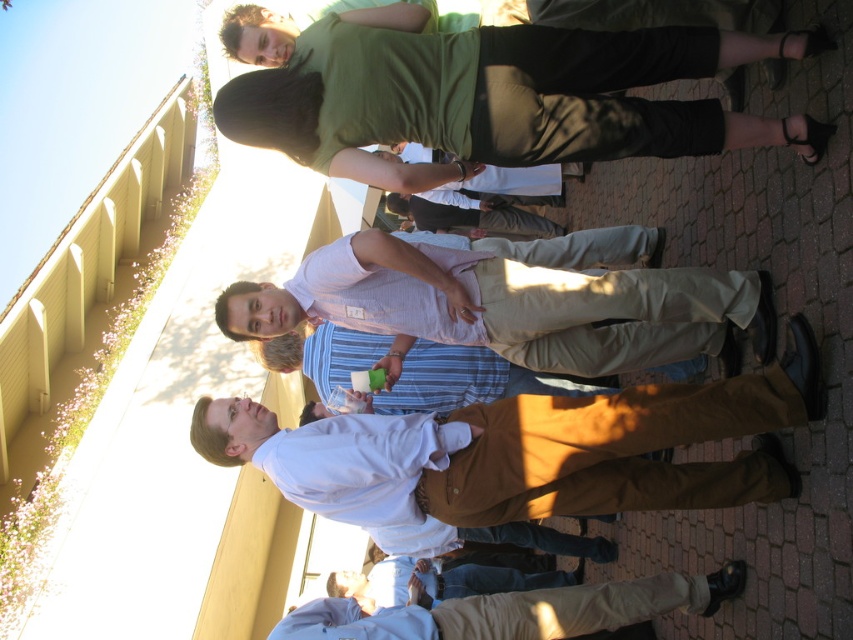
Does green cotton shirt at upper center have a smaller size compared to light brown cotton pants at center?

Indeed, green cotton shirt at upper center has a smaller size compared to light brown cotton pants at center.

Does green cotton shirt at upper center have a greater width compared to light brown cotton pants at center?

Incorrect, green cotton shirt at upper center's width does not surpass light brown cotton pants at center's.

Identify the location of green cotton shirt at upper center. The image size is (853, 640). (498, 96).

The image size is (853, 640). I want to click on green cotton shirt at upper center, so click(x=498, y=96).

Does light brown cotton pants at center appear on the right side of light brown leather pants at lower center?

Yes, light brown cotton pants at center is to the right of light brown leather pants at lower center.

Is light brown cotton pants at center to the left of light brown leather pants at lower center from the viewer's perspective?

Incorrect, light brown cotton pants at center is not on the left side of light brown leather pants at lower center.

What do you see at coordinates (503, 305) in the screenshot? I see `light brown cotton pants at center` at bounding box center [503, 305].

Where is `light brown cotton pants at center`? Image resolution: width=853 pixels, height=640 pixels. light brown cotton pants at center is located at coordinates (503, 305).

Between light brown leather pants at lower center and khaki cotton pants at center, which one appears on the left side from the viewer's perspective?

khaki cotton pants at center is more to the left.

Does light brown leather pants at lower center appear under khaki cotton pants at center?

Yes, light brown leather pants at lower center is below khaki cotton pants at center.

Who is more distant from viewer, (567,632) or (416,208)?

The point (416,208) is behind.

Where is `light brown leather pants at lower center`? This screenshot has width=853, height=640. light brown leather pants at lower center is located at coordinates (519, 611).